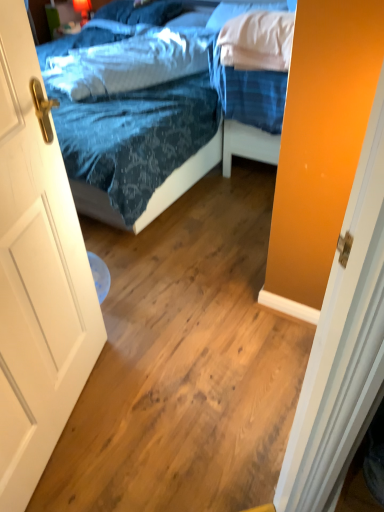
Where is `vacant region under white wooden door at left (from a real-world perspective)`? vacant region under white wooden door at left (from a real-world perspective) is located at coordinates (71, 420).